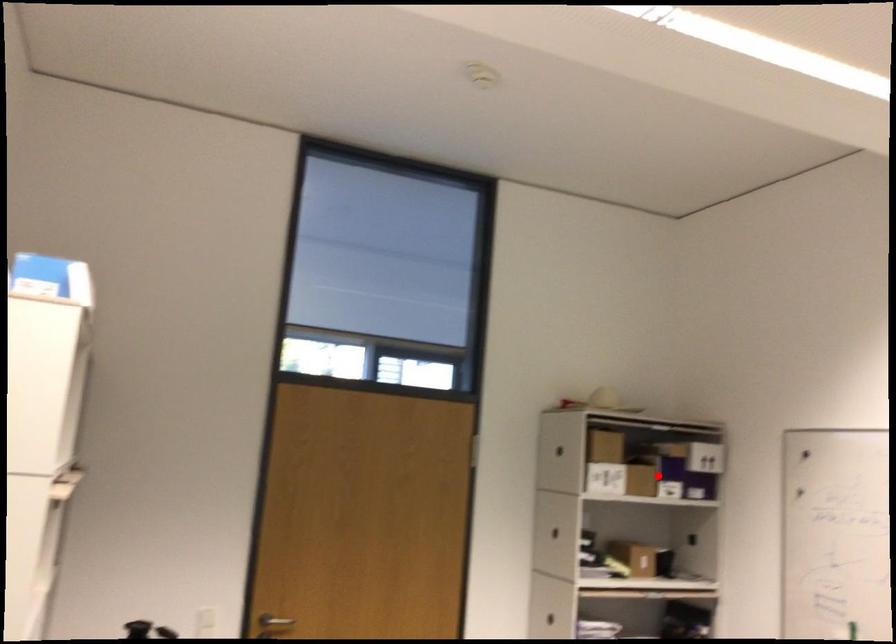
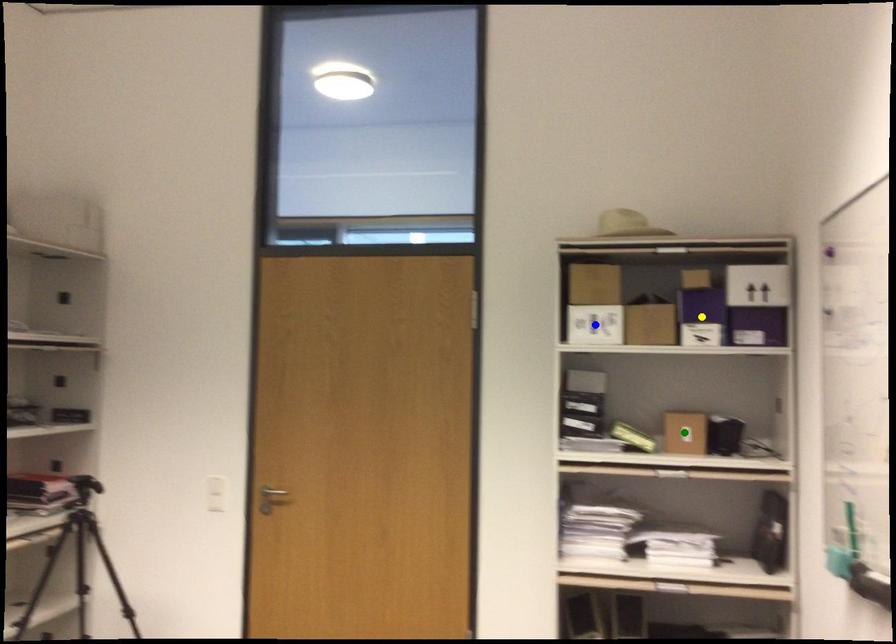
Question: I am providing you with two images of the same scene from different viewpoints. A red point is marked on the first image. You are given multiple points on the second image. Which point in image 2 is actually the same real-world point as the red point in image 1?

Choices:
 (A) yellow point
 (B) blue point
 (C) green point

Answer: (A)